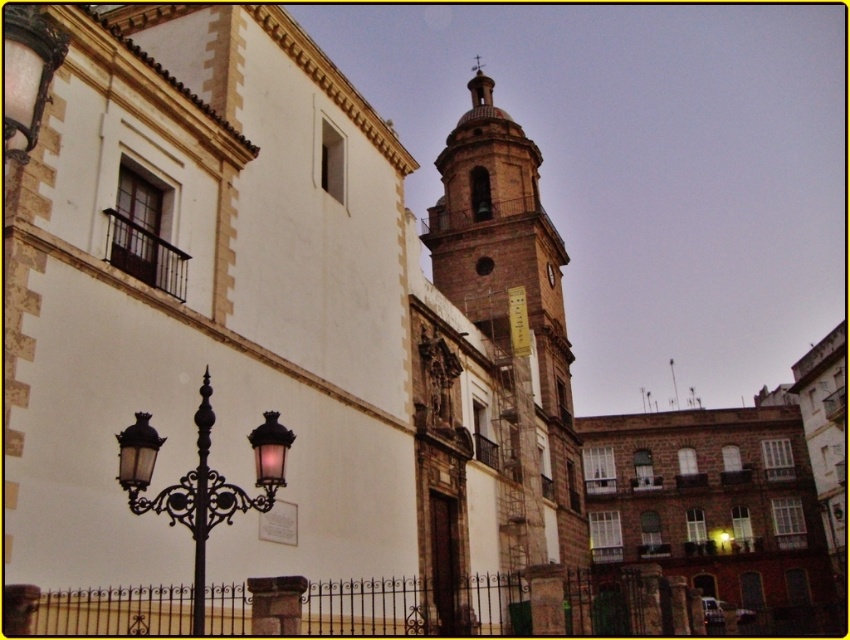
Who is more forward, (238,368) or (267,454)?

Point (267,454) is more forward.

Does brown stone church at center have a greater height compared to matte black lamp post at lower left?

Correct, brown stone church at center is much taller as matte black lamp post at lower left.

Locate an element on the screen. brown stone church at center is located at coordinates (275, 314).

Between brown stone clock tower at center and matte black lamp post at lower left, which one is positioned higher?

brown stone clock tower at center is above.

Can you confirm if brown stone clock tower at center is positioned below matte black lamp post at lower left?

Actually, brown stone clock tower at center is above matte black lamp post at lower left.

Is point (445, 310) less distant than point (259, 476)?

No, it is behind (259, 476).

The height and width of the screenshot is (640, 850). I want to click on brown stone clock tower at center, so click(x=490, y=376).

Is brown stone church at center positioned in front of brown stone clock tower at center?

Yes, brown stone church at center is closer to the viewer.

Is brown stone church at center shorter than brown stone clock tower at center?

Indeed, brown stone church at center has a lesser height compared to brown stone clock tower at center.

Where is `brown stone church at center`? This screenshot has width=850, height=640. brown stone church at center is located at coordinates [x=275, y=314].